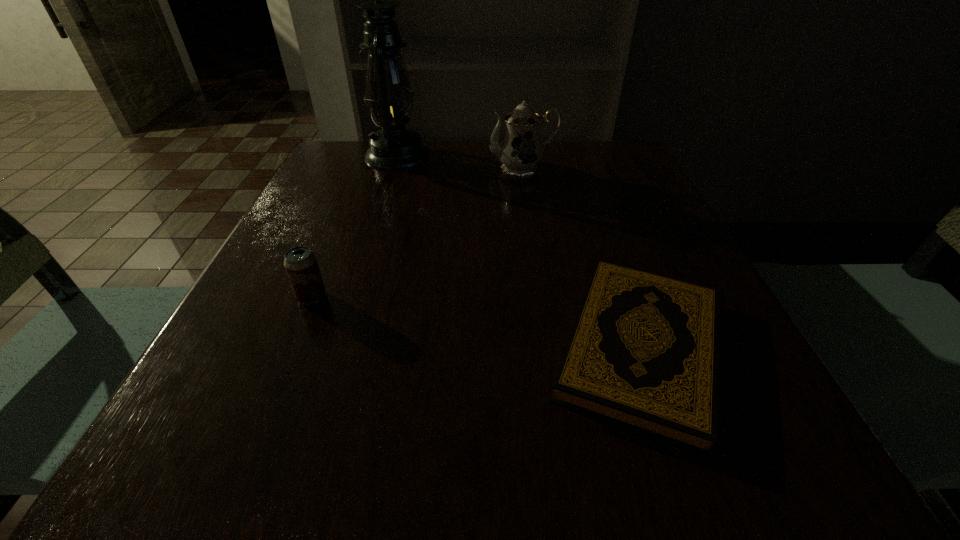
The height and width of the screenshot is (540, 960). Find the location of `oil lamp`. oil lamp is located at coordinates (389, 95).

Locate an element on the screen. Image resolution: width=960 pixels, height=540 pixels. the third shortest object is located at coordinates (520, 152).

Find the location of a particular element. Image resolution: width=960 pixels, height=540 pixels. the second shortest object is located at coordinates (300, 263).

The height and width of the screenshot is (540, 960). I want to click on the shortest object, so click(x=643, y=353).

This screenshot has height=540, width=960. In order to click on vacant space located 0.310m on the front of the tallest object in this screenshot , I will do `click(367, 251)`.

Find the location of a particular element. vacant region located 0.320m on the left of the third shortest object is located at coordinates (358, 168).

Where is `vacant space located on the left of the beer can`? vacant space located on the left of the beer can is located at coordinates (244, 297).

Find the location of `vacant space located on the back of the hardback book`. vacant space located on the back of the hardback book is located at coordinates (582, 181).

Find the location of `oil lamp that is at the far edge`. oil lamp that is at the far edge is located at coordinates (389, 95).

In order to click on chinaware at the far edge in this screenshot , I will do `click(520, 152)`.